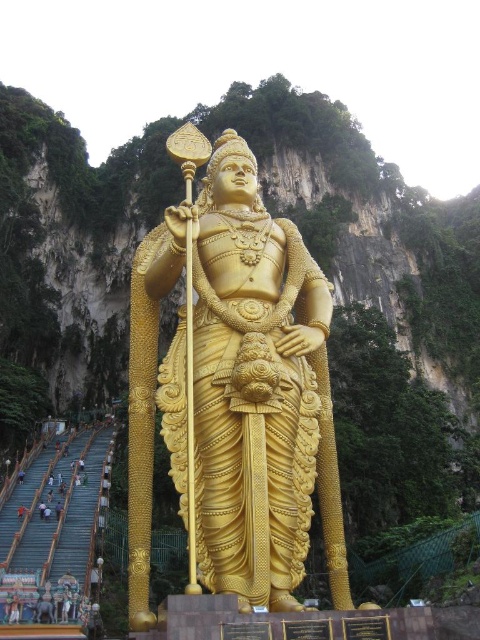
Who is positioned more to the right, gold polished statue at center or light brown skin at lower left?

gold polished statue at center is more to the right.

Which is behind, point (131, 609) or point (60, 512)?

The point (60, 512) is more distant.

Between point (215, 205) and point (60, 508), which one is positioned behind?

Positioned behind is point (60, 508).

At what (x,y) coordinates should I click in order to perform the action: click on gold polished statue at center. Please return your answer as a coordinate pair (x, y). Looking at the image, I should click on point(235,388).